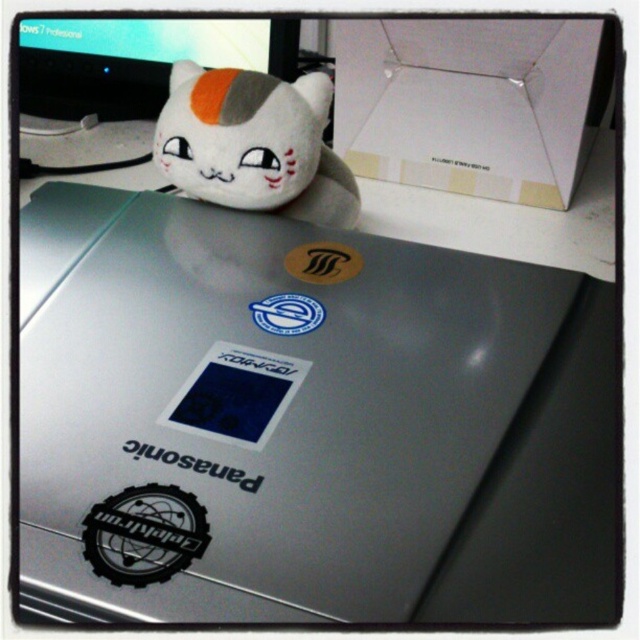
Where is `matte black monitor at upper left`? This screenshot has height=640, width=640. matte black monitor at upper left is located at coordinates (136, 60).

Is matte black monitor at upper left above blue matte sticker at center?

Yes, matte black monitor at upper left is above blue matte sticker at center.

Locate an element on the screen. This screenshot has width=640, height=640. matte black monitor at upper left is located at coordinates (136, 60).

This screenshot has height=640, width=640. What do you see at coordinates (260, 403) in the screenshot? I see `silver metallic laptop at center` at bounding box center [260, 403].

You are a GUI agent. You are given a task and a screenshot of the screen. Output one action in this format:
    pyautogui.click(x=<x>, y=<y>)
    Task: Click on the silver metallic laptop at center
    Image resolution: width=640 pixels, height=640 pixels.
    Given the screenshot: What is the action you would take?
    pyautogui.click(x=260, y=403)

Where is `silver metallic laptop at center`? silver metallic laptop at center is located at coordinates (260, 403).

Does point (83, 348) come in front of point (38, 35)?

Yes, point (83, 348) is closer to viewer.

Does silver metallic laptop at center lie behind matte black monitor at upper left?

No, silver metallic laptop at center is in front of matte black monitor at upper left.

Is point (557, 307) less distant than point (115, 80)?

Yes.

Where is `silver metallic laptop at center`? This screenshot has height=640, width=640. silver metallic laptop at center is located at coordinates (260, 403).